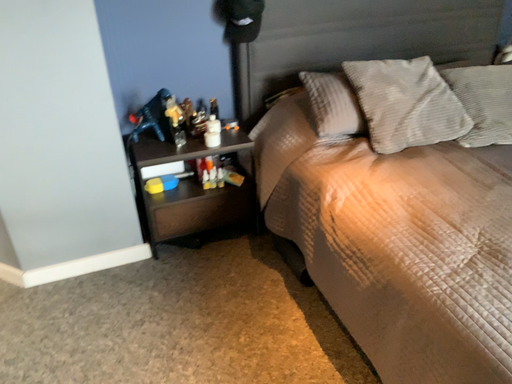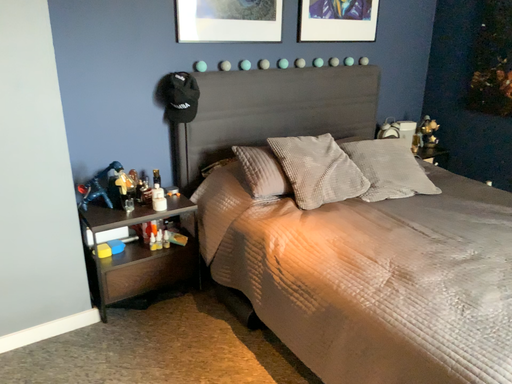
Question: Which way did the camera rotate in the video?

Choices:
 (A) rotated upward
 (B) rotated downward

Answer: (A)